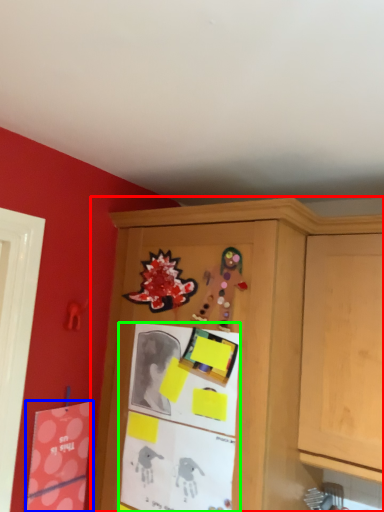
Question: Which object is positioned closest to cabinetry (highlighted by a red box)? Select from postcard (highlighted by a blue box) and bulletin board (highlighted by a green box).

Choices:
 (A) postcard
 (B) bulletin board

Answer: (B)